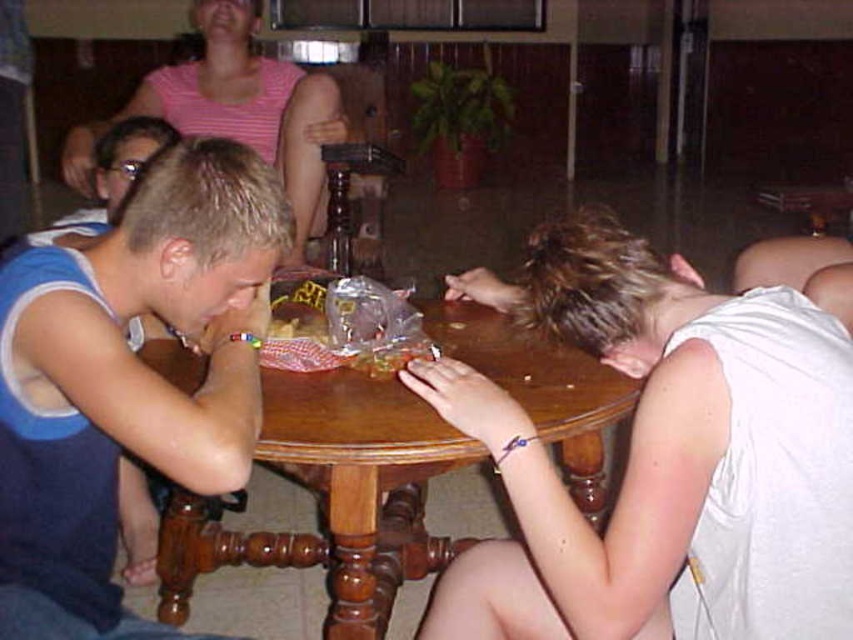
You are a guest at the gathering and want to place a small item on the table. You notice the white matte shirt at lower right and the wooden at center. Which object is closer to the right edge of the table?

The white matte shirt at lower right is positioned on the right side of wooden at center, so it is closer to the right edge of the table.

You are standing at the center of the room and want to reach the white matte shirt at lower right. According to the coordinates provided, in which direction should you move to get closer to it?

The white matte shirt at lower right is located at point 0.717 on the x axis and 0.776 on the y axis. Since you are at the center, you should move towards the lower right direction to reach it.